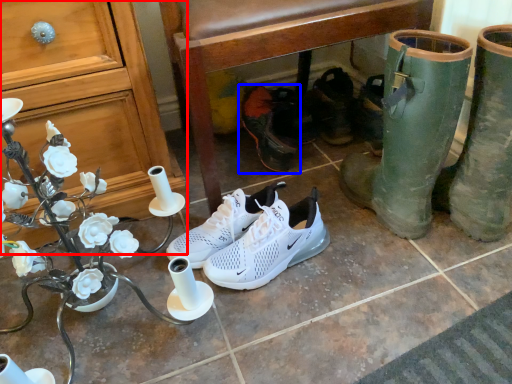
Question: Which object is closer to the camera taking this photo, cabinetry (highlighted by a red box) or footwear (highlighted by a blue box)?

Choices:
 (A) cabinetry
 (B) footwear

Answer: (A)